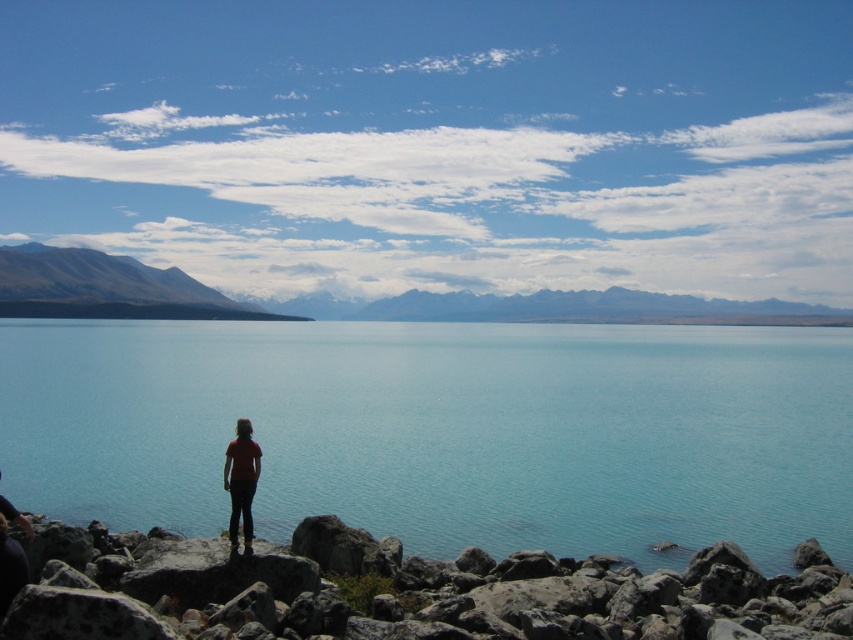
Question: Considering the relative positions of clear blue water at center and snowy rocky mountain at left in the image provided, where is clear blue water at center located with respect to snowy rocky mountain at left?

Choices:
 (A) below
 (B) above

Answer: (A)

Question: Among these objects, which one is farthest from the camera?

Choices:
 (A) clear blue water at center
 (B) matte red shirt at center
 (C) gray rough rock at lower center
 (D) snowy rocky mountain at left

Answer: (D)

Question: Which object is the farthest from the matte red shirt at center?

Choices:
 (A) snowy rocky mountain at left
 (B) gray rough rock at lower center
 (C) clear blue water at center

Answer: (A)

Question: Which of the following is the closest to the observer?

Choices:
 (A) (206, 563)
 (B) (635, 372)
 (C) (253, 464)
 (D) (161, 292)

Answer: (A)

Question: Is clear blue water at center in front of snowy rocky mountain at left?

Choices:
 (A) yes
 (B) no

Answer: (A)

Question: Does gray rough rock at lower center appear on the left side of matte red shirt at center?

Choices:
 (A) yes
 (B) no

Answer: (B)